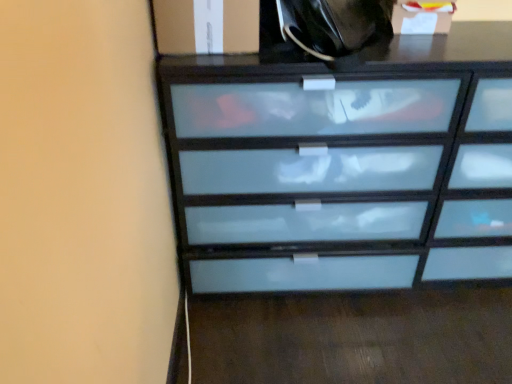
Question: Is point (305, 43) positioned closer to the camera than point (437, 11)?

Choices:
 (A) farther
 (B) closer

Answer: (B)

Question: From the image's perspective, is black glossy tote bag at upper center positioned above or below white frosted glass cabinet at upper right, positioned as the 1th cabinetry in right-to-left order?

Choices:
 (A) above
 (B) below

Answer: (B)

Question: Which object is positioned farthest from the white frosted glass cabinet at upper right, positioned as the 1th cabinetry in right-to-left order?

Choices:
 (A) frosted glass chest of drawers at center
 (B) black glossy tote bag at upper center
 (C) white frosted glass cabinet at upper left, placed as the 1th cabinetry when sorted from left to right

Answer: (C)

Question: Which is farther from the white frosted glass cabinet at upper right, which is the 2th cabinetry from left to right?

Choices:
 (A) black glossy tote bag at upper center
 (B) white frosted glass cabinet at upper left, placed as the 1th cabinetry when sorted from left to right
 (C) frosted glass chest of drawers at center

Answer: (B)